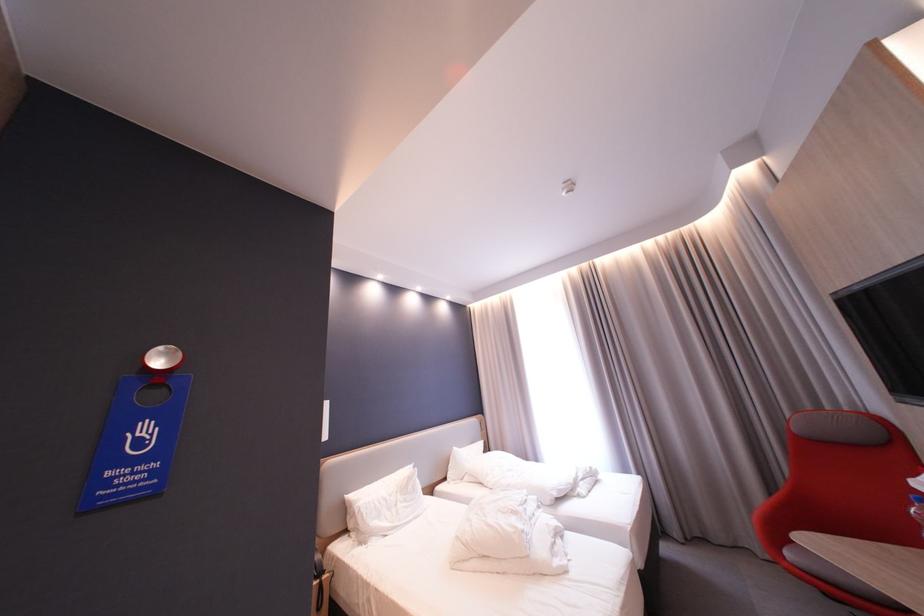
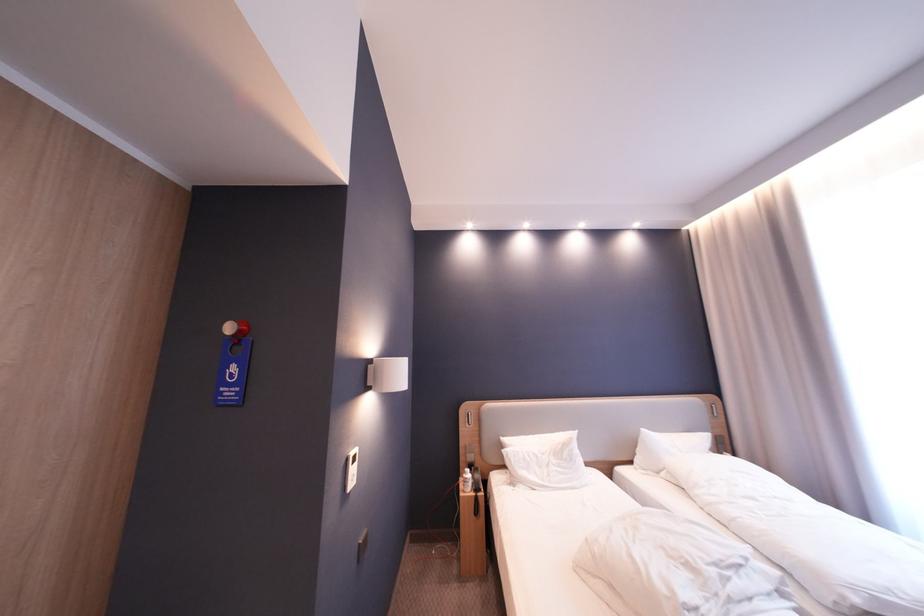
Where in the second image is the point corresponding to pixel 157 431 from the first image?

(245, 370)